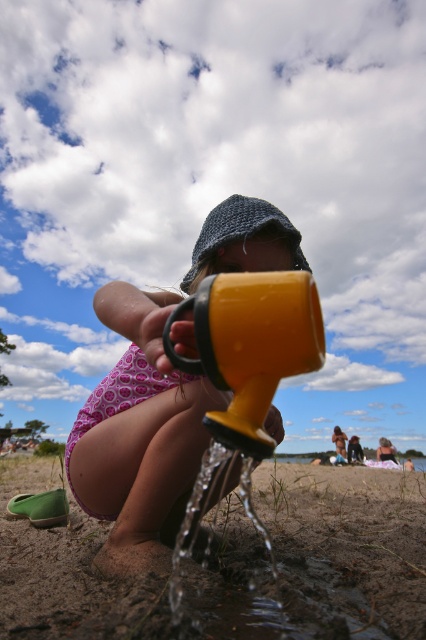
Is point (233, 500) positioned after point (97, 301)?

That is True.

Locate an element on the screen. transparent plastic water at lower center is located at coordinates (347, 548).

You are a GUI agent. You are given a task and a screenshot of the screen. Output one action in this format:
    pyautogui.click(x=<x>, y=<y>)
    Task: Click on the transparent plastic water at lower center
    The height and width of the screenshot is (640, 426).
    Given the screenshot: What is the action you would take?
    click(347, 548)

Is yellow matte watering can at center bigger than yellow plastic cup at center?

Yes, yellow matte watering can at center is bigger than yellow plastic cup at center.

Does point (163, 403) lie in front of point (256, 369)?

No.

I want to click on yellow matte watering can at center, so click(138, 435).

Which is more to the left, transparent plastic water at lower center or yellow plastic cup at center?

yellow plastic cup at center

Which is in front, point (230, 632) or point (268, 275)?

Point (268, 275)

Which is behind, point (356, 600) or point (261, 358)?

The point (356, 600) is more distant.

Locate an element on the screen. The height and width of the screenshot is (640, 426). transparent plastic water at lower center is located at coordinates (347, 548).